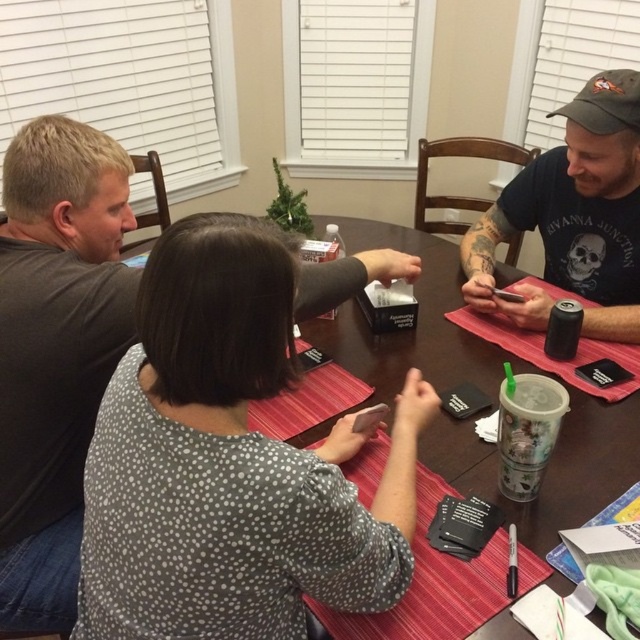
You are a photographer trying to capture a candid shot of the white dotted shirt at center and the dark gray cap at upper right. Since you want to ensure both subjects are in focus, you need to know if they are within the same focal plane. Based on their positions, can you determine if they are likely in the same focal plane?

The white dotted shirt at center might be wider than dark gray cap at upper right, so they may not be in the same focal plane since their widths differ.

You are trying to decide which item to grab first from the table. The white dotted shirt at center and the dark gray cap at upper right are both within reach. Based on their sizes, which one should you pick up first if you want to handle the smaller object first?

The white dotted shirt at center is shorter than the dark gray cap at upper right, so you should pick up the white dotted shirt at center first since it is the smaller object.

You are a photographer taking a picture of the scene. You notice the white dotted shirt at center and the dark gray cap at upper right. Which object should you focus on first if you want to capture both in the same frame without moving the camera?

You should focus on the white dotted shirt at center first because it is closer to the camera than the dark gray cap at upper right, allowing both to be in focus within the same frame.